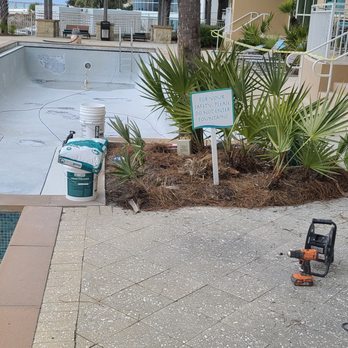
In order to click on brown tiles in this screenshot , I will do `click(27, 275)`.